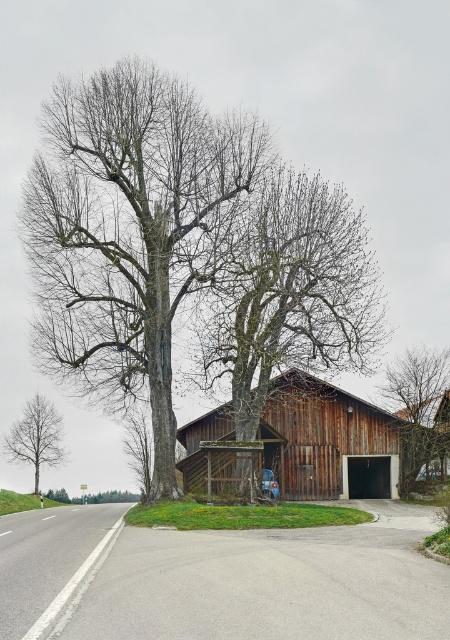
Based on the scene description, where is the wooden barn at center located in terms of its 2D coordinates?

The wooden barn at center is located at the 2D coordinates point [328,440].

You are a farmer standing at the edge of your property and want to check both the wooden barn at center and the smooth gray tree at left. Based on their positions, which one would you encounter first while walking from your current position towards the image?

The smooth gray tree at left is encountered first because the wooden barn at center is to the right of it, meaning the tree is closer to your starting position.